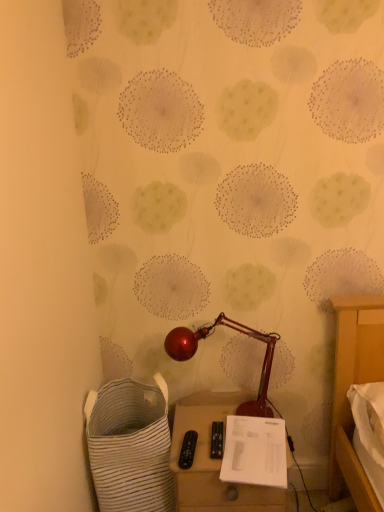
Question: Is white paper at lower center facing towards shiny metallic lamp at center?

Choices:
 (A) yes
 (B) no

Answer: (B)

Question: Is white paper at lower center further to the viewer compared to shiny metallic lamp at center?

Choices:
 (A) no
 (B) yes

Answer: (A)

Question: Is white paper at lower center not near shiny metallic lamp at center?

Choices:
 (A) yes
 (B) no

Answer: (B)

Question: Is white paper at lower center closer to camera compared to shiny metallic lamp at center?

Choices:
 (A) no
 (B) yes

Answer: (B)

Question: Considering the relative sizes of white paper at lower center and shiny metallic lamp at center in the image provided, is white paper at lower center shorter than shiny metallic lamp at center?

Choices:
 (A) no
 (B) yes

Answer: (B)

Question: From the image's perspective, is matte beige side table at lower center located above or below white paper at lower center?

Choices:
 (A) below
 (B) above

Answer: (A)

Question: Considering the positions of matte beige side table at lower center and white paper at lower center in the image, is matte beige side table at lower center taller or shorter than white paper at lower center?

Choices:
 (A) short
 (B) tall

Answer: (B)

Question: Relative to white paper at lower center, is matte beige side table at lower center in front or behind?

Choices:
 (A) front
 (B) behind

Answer: (B)

Question: Is matte beige side table at lower center spatially inside white paper at lower center, or outside of it?

Choices:
 (A) outside
 (B) inside

Answer: (A)

Question: Would you say shiny metallic lamp at center is to the left or to the right of white striped fabric laundry basket at lower left in the picture?

Choices:
 (A) left
 (B) right

Answer: (B)

Question: In the image, is shiny metallic lamp at center positioned in front of or behind white striped fabric laundry basket at lower left?

Choices:
 (A) front
 (B) behind

Answer: (B)

Question: From a real-world perspective, is shiny metallic lamp at center positioned above or below white striped fabric laundry basket at lower left?

Choices:
 (A) below
 (B) above

Answer: (B)

Question: Is shiny metallic lamp at center wider or thinner than white striped fabric laundry basket at lower left?

Choices:
 (A) wide
 (B) thin

Answer: (B)

Question: Considering the positions of matte beige side table at lower center and shiny metallic lamp at center in the image, is matte beige side table at lower center taller or shorter than shiny metallic lamp at center?

Choices:
 (A) short
 (B) tall

Answer: (B)

Question: In the image, is matte beige side table at lower center positioned in front of or behind shiny metallic lamp at center?

Choices:
 (A) front
 (B) behind

Answer: (A)